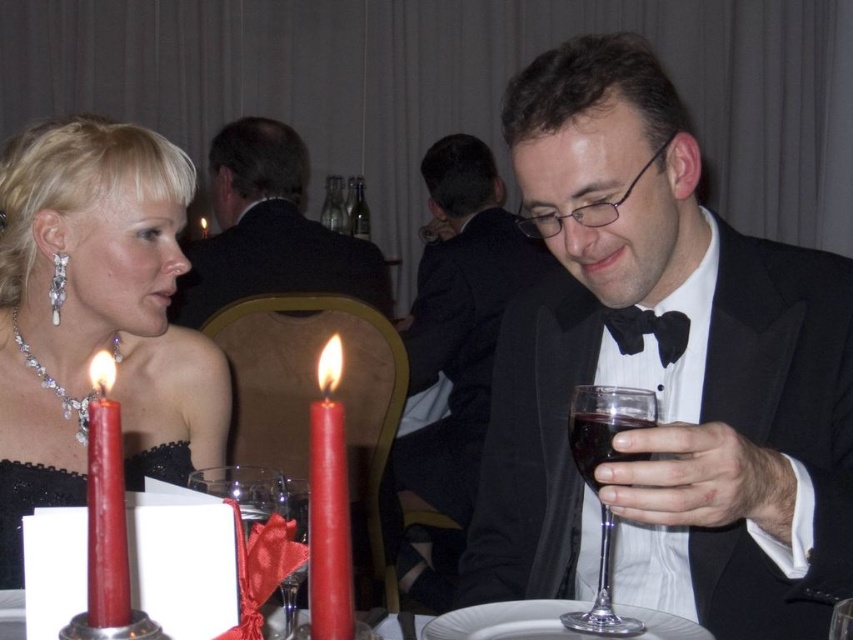
Measure the distance from transparent glass wine glass at right to black satin bow tie at center.

The distance of transparent glass wine glass at right from black satin bow tie at center is 9.14 inches.

Is transparent glass wine glass at right taller than black satin bow tie at center?

Indeed, transparent glass wine glass at right has a greater height compared to black satin bow tie at center.

Between point (606, 444) and point (640, 323), which one is positioned in front?

Point (606, 444) is in front.

The height and width of the screenshot is (640, 853). I want to click on transparent glass wine glass at right, so click(605, 426).

Is red matte candle at left taller than transparent glass wine glass at right?

Incorrect, red matte candle at left's height is not larger of transparent glass wine glass at right's.

Between red matte candle at left and transparent glass wine glass at right, which one has more height?

With more height is transparent glass wine glass at right.

Identify the location of red matte candle at left. This screenshot has width=853, height=640. (328, 506).

Does black satin tuxedo at center lie behind red wax candle at left?

Yes, it is.

Is point (723, 348) positioned behind point (90, 424)?

Yes.

Identify the location of black satin tuxedo at center. Image resolution: width=853 pixels, height=640 pixels. (662, 372).